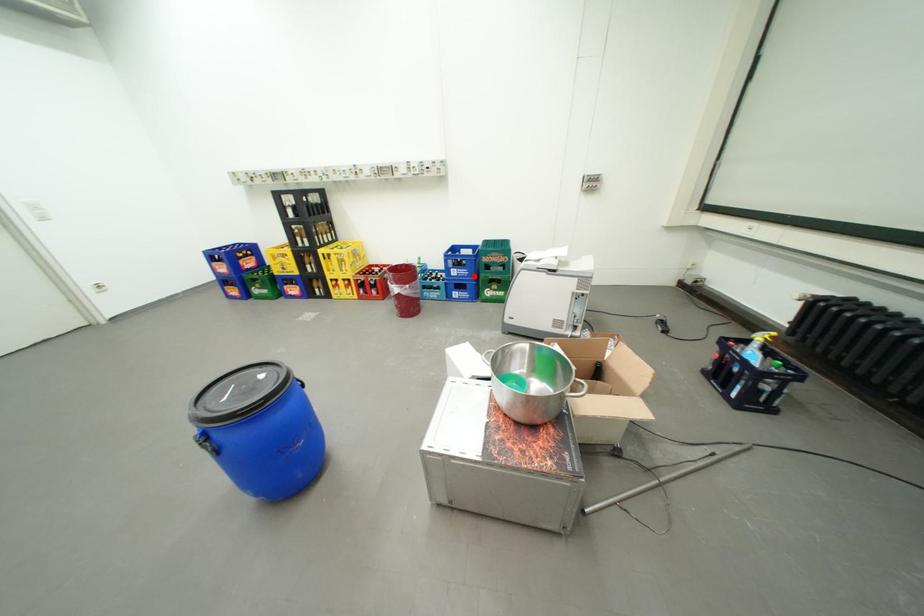
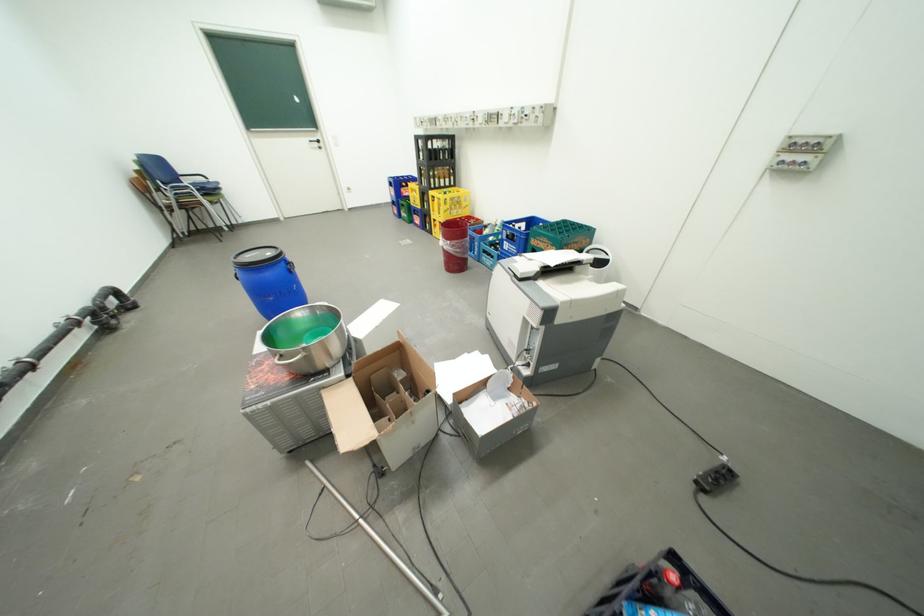
Question: I am providing you with two images of the same scene from different viewpoints. A red point is shown in image1. For the corresponding object point in image2, is it positioned nearer or farther from the camera?

Choices:
 (A) Nearer
 (B) Farther

Answer: (B)